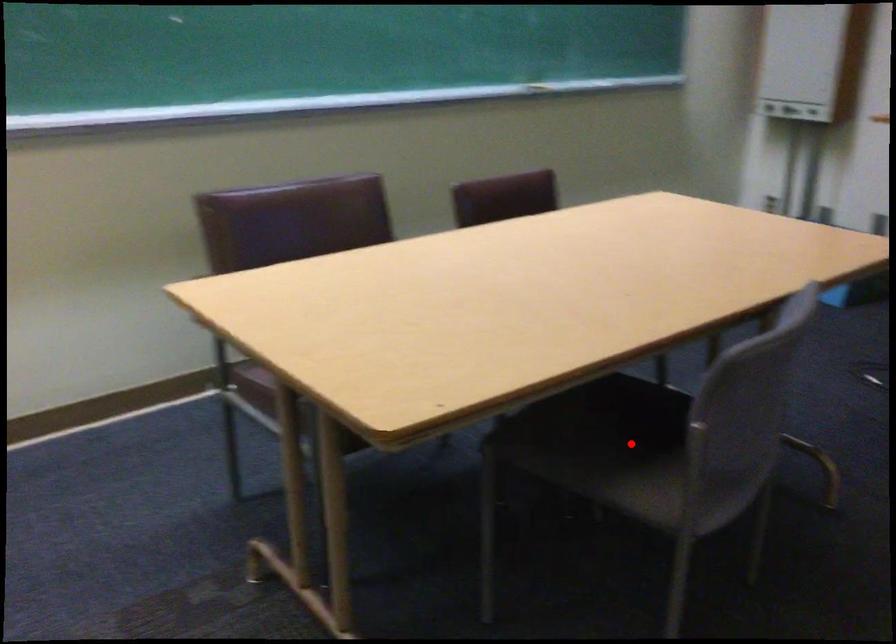
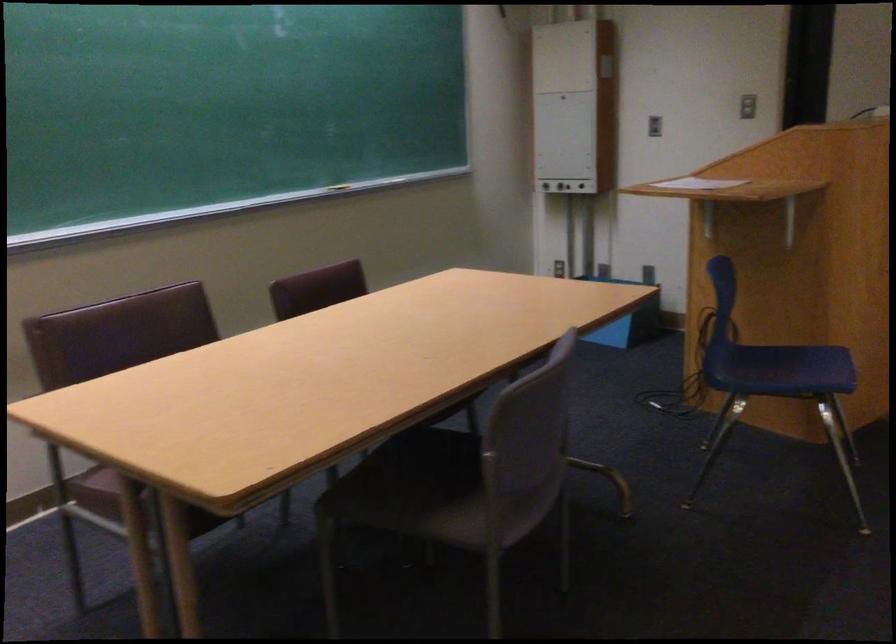
Where in the second image is the point corresponding to the highlighted location from the first image?

(454, 487)